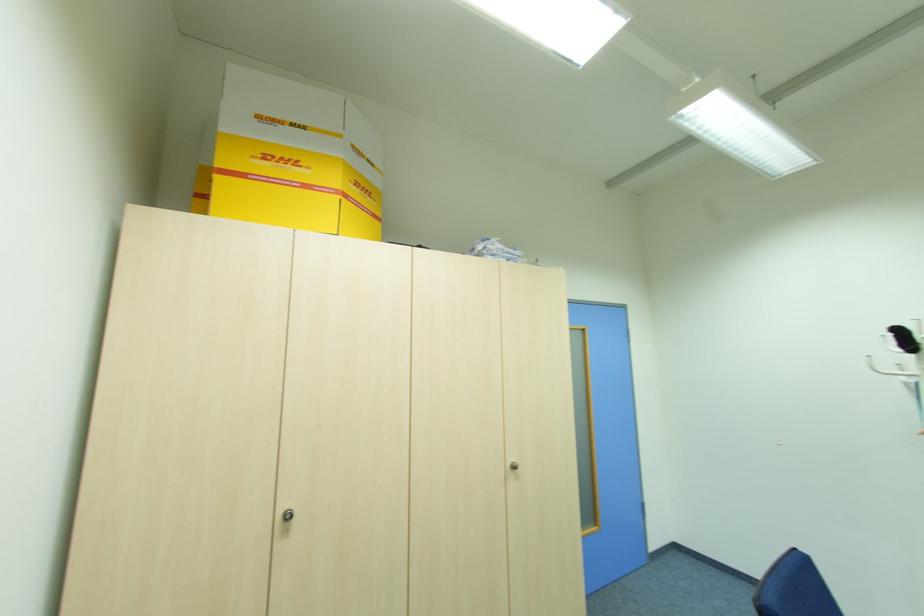
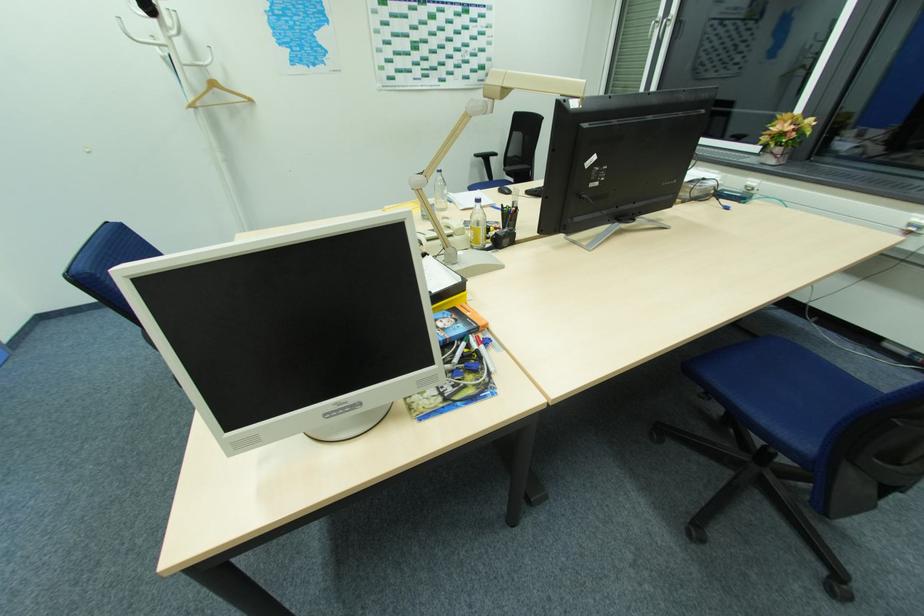
The first image is from the beginning of the video and the second image is from the end. How did the camera likely rotate when shooting the video?

The camera's rotation is toward right-down.